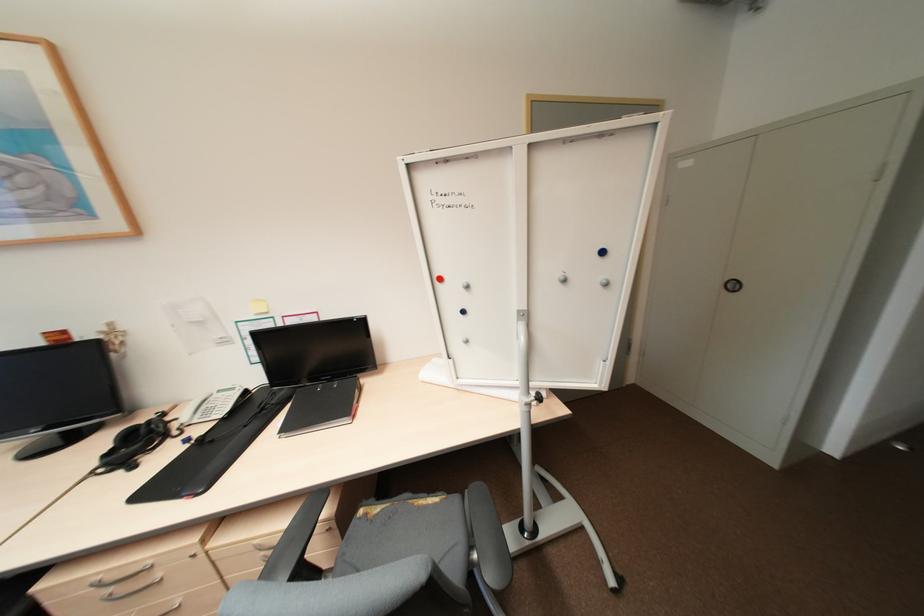
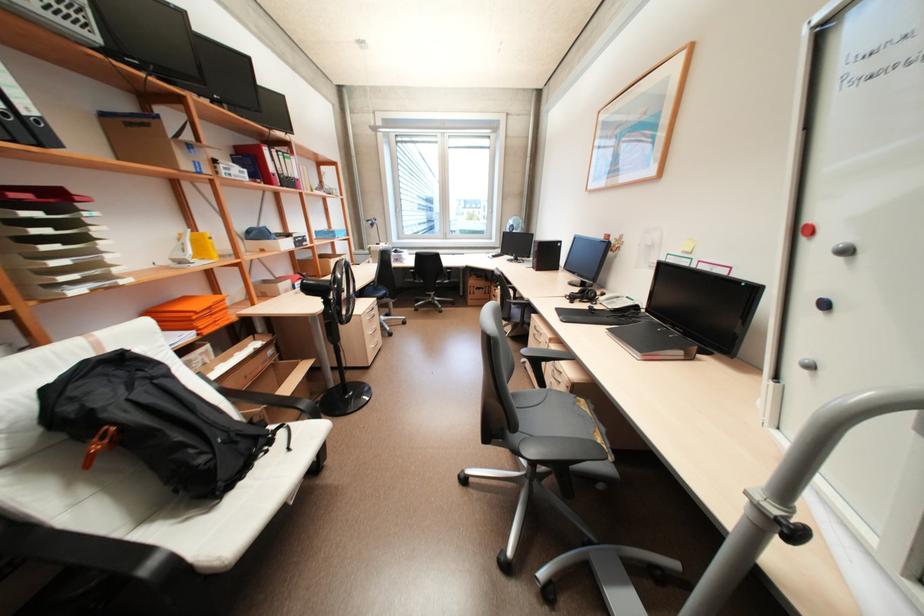
The point at (371,514) is marked in the first image. Where is the corresponding point in the second image?

(585, 400)